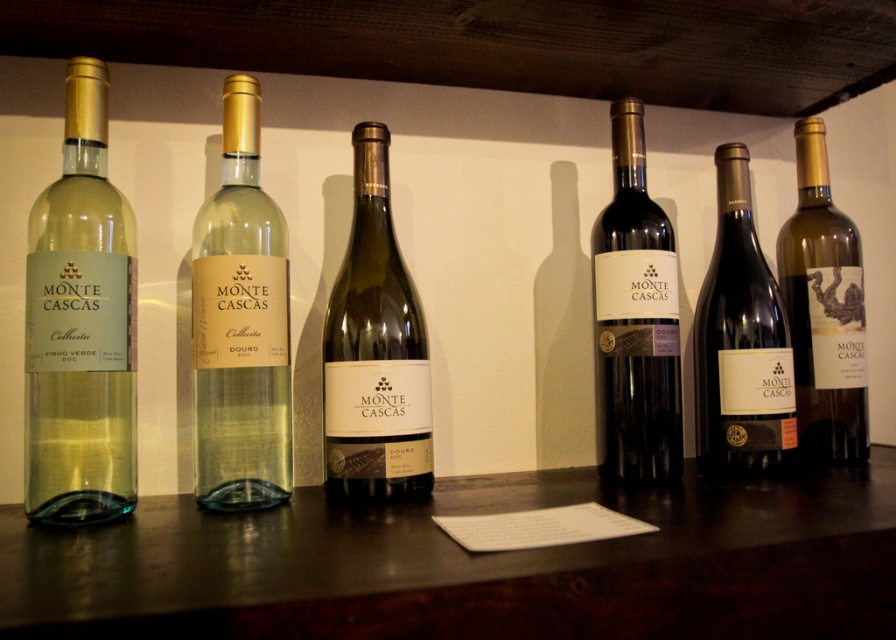
Question: Can you confirm if matte glass bottle at left is smaller than matte glass wine bottle at center?

Choices:
 (A) yes
 (B) no

Answer: (B)

Question: Is matte glass wine bottle at left above green glass bottle at center?

Choices:
 (A) yes
 (B) no

Answer: (A)

Question: Which point is farther to the camera?

Choices:
 (A) matte glass wine bottle at left
 (B) green glass bottle at center
 (C) matte gold wine bottle at right

Answer: (C)

Question: Is the position of matte glass bottle at left less distant than that of shiny dark glass bottle at center?

Choices:
 (A) yes
 (B) no

Answer: (A)

Question: Among these points, which one is nearest to the camera?

Choices:
 (A) (425, 356)
 (B) (84, 298)
 (C) (434, 333)
 (D) (626, 204)

Answer: (B)

Question: Which point appears farthest from the camera in this image?

Choices:
 (A) (816, 456)
 (B) (203, 614)

Answer: (A)